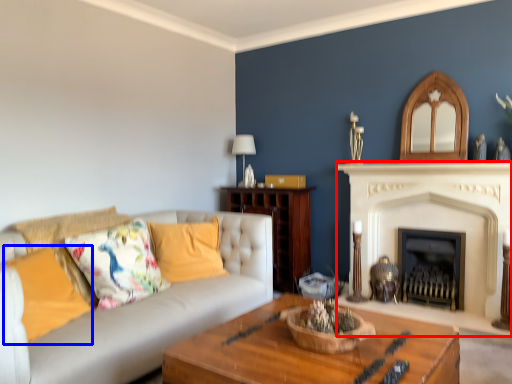
Question: Among these objects, which one is farthest to the camera, fireplace (highlighted by a red box) or pillow (highlighted by a blue box)?

Choices:
 (A) fireplace
 (B) pillow

Answer: (A)